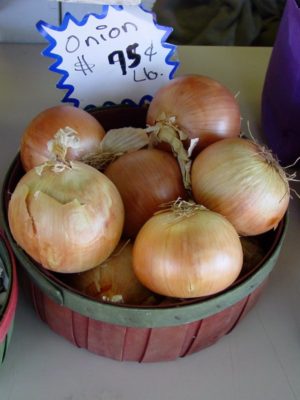
Locate an element on the screen. The height and width of the screenshot is (400, 300). fabric item is located at coordinates (222, 10).